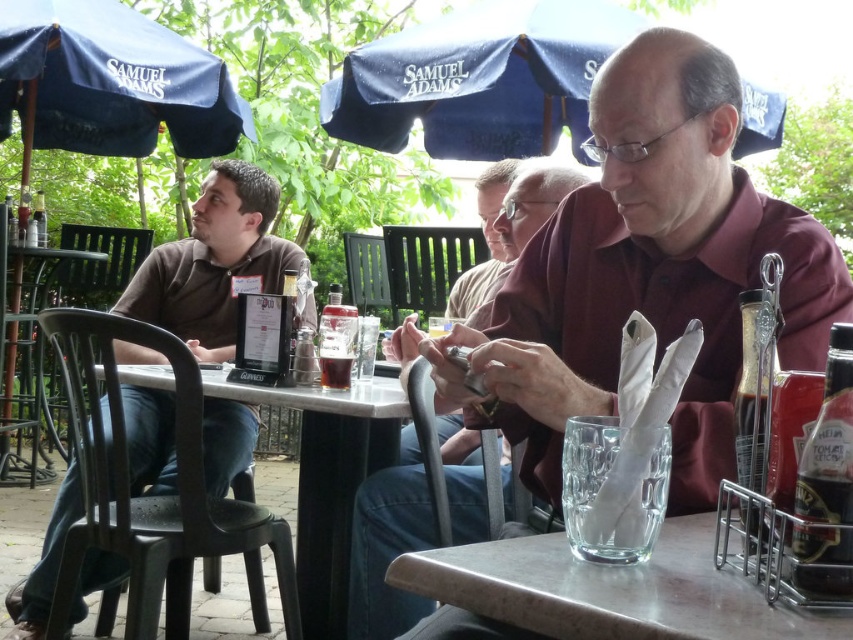
Who is shorter, white plastic table at center or black plastic chair at left?

With less height is white plastic table at center.

Between point (323, 544) and point (16, 346), which one is positioned behind?

Point (16, 346)

Locate an element on the screen. The height and width of the screenshot is (640, 853). white plastic table at center is located at coordinates (329, 480).

Between brown cotton shirt at left and matte brown shirt at center, which one has more height?

Standing taller between the two is brown cotton shirt at left.

Where is `brown cotton shirt at left`? brown cotton shirt at left is located at coordinates [x=213, y=260].

Who is more distant from viewer, (548, 40) or (140, 44)?

The point (140, 44) is behind.

Between blue fabric umbrella at upper center and blue fabric umbrella at upper left, which one appears on the left side from the viewer's perspective?

Positioned to the left is blue fabric umbrella at upper left.

Does point (378, 125) come behind point (184, 52)?

Yes, it is.

Locate an element on the screen. blue fabric umbrella at upper center is located at coordinates (479, 77).